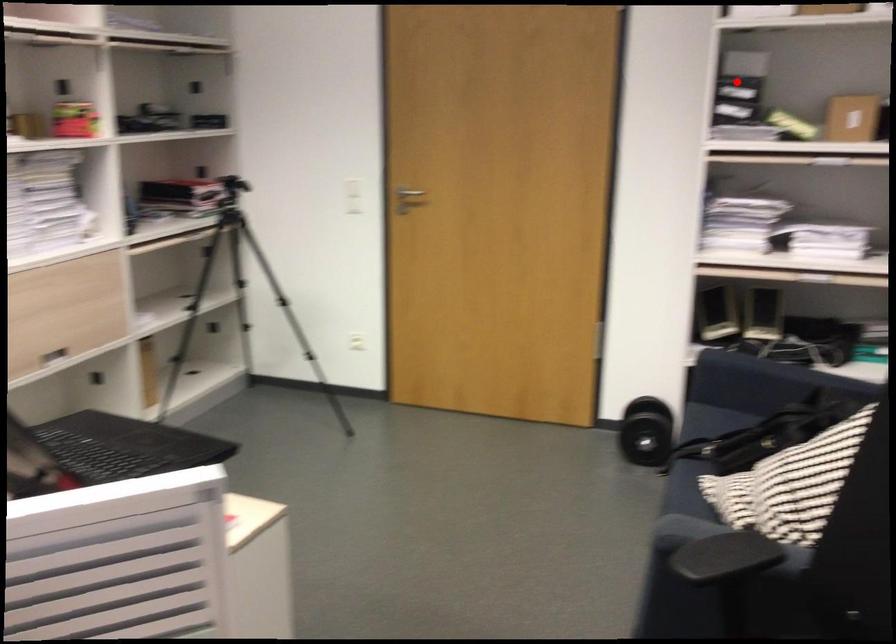
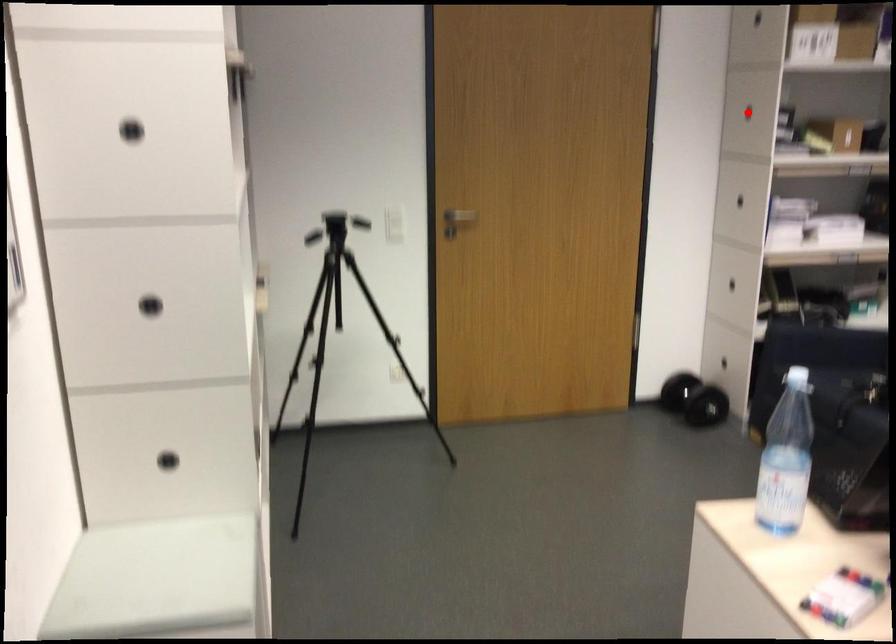
I am providing you with two images of the same scene from different viewpoints. A red point is marked on the first image and another point is marked on the second image. Is the marked point in image1 the same physical position as the marked point in image2?

Yes